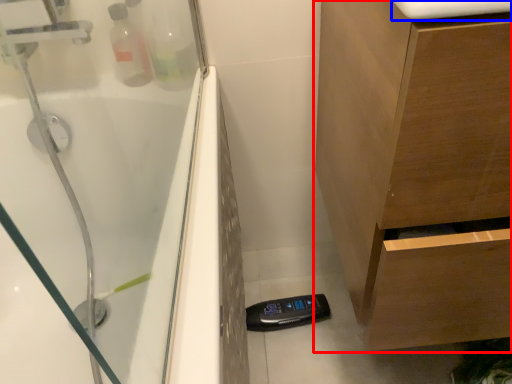
Question: Among these objects, which one is nearest to the camera, bathroom cabinet (highlighted by a red box) or counter top (highlighted by a blue box)?

Choices:
 (A) bathroom cabinet
 (B) counter top

Answer: (A)